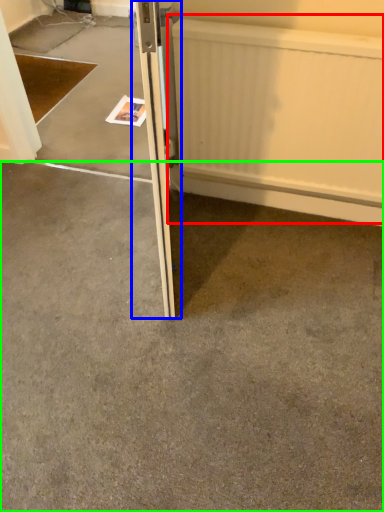
Question: Which object is the farthest from radiator (highlighted by a red box)? Choose among these: door (highlighted by a blue box) or concrete (highlighted by a green box).

Choices:
 (A) door
 (B) concrete

Answer: (B)